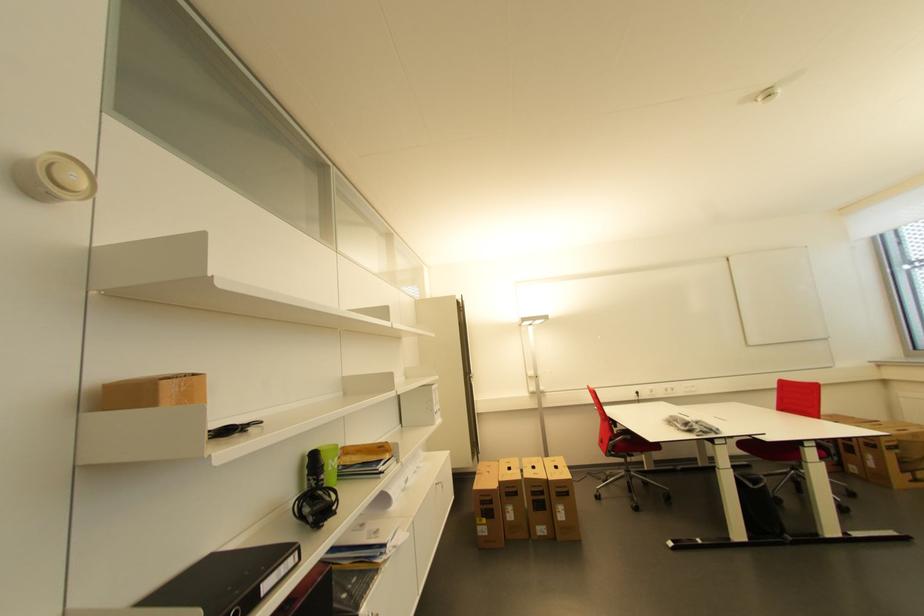
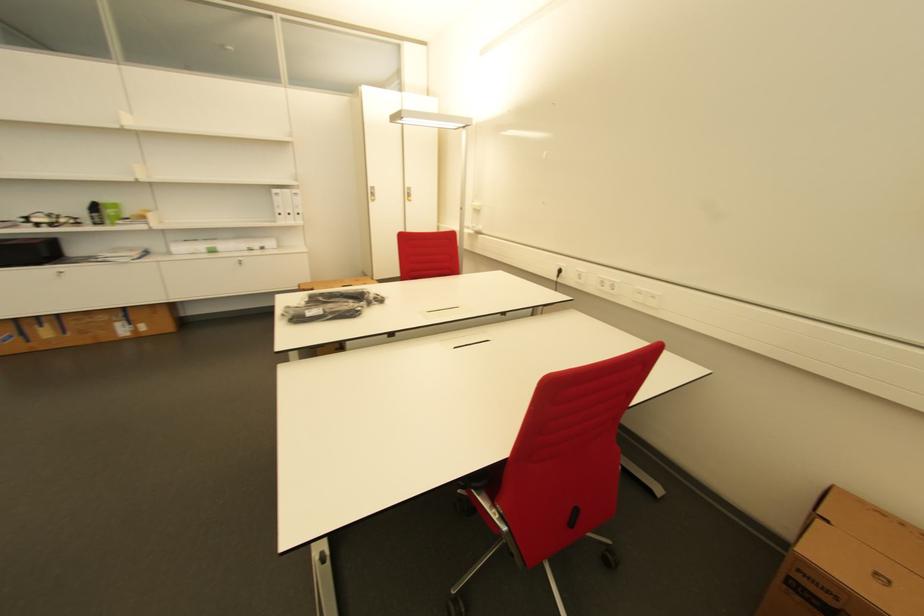
The point at (320,464) is marked in the first image. Where is the corresponding point in the second image?

(100, 209)